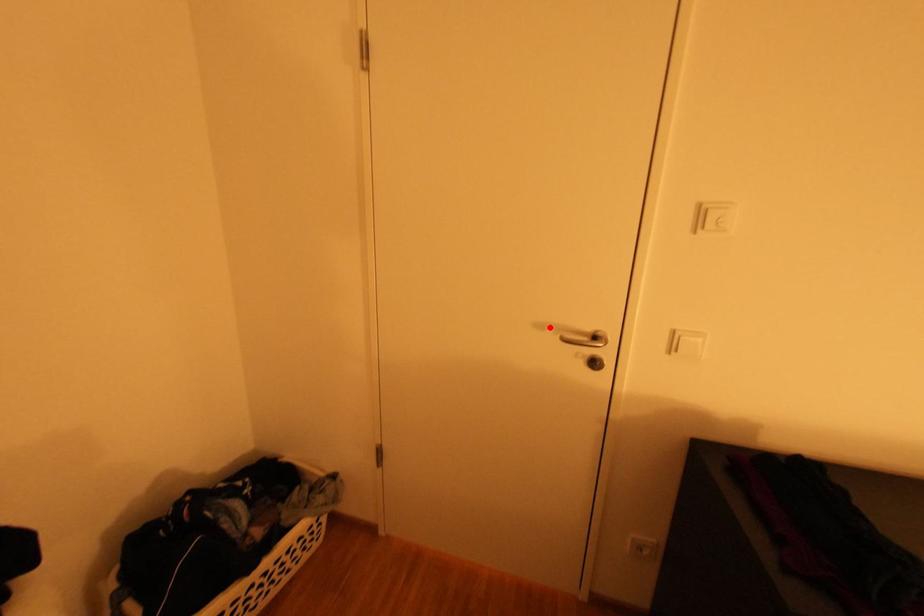
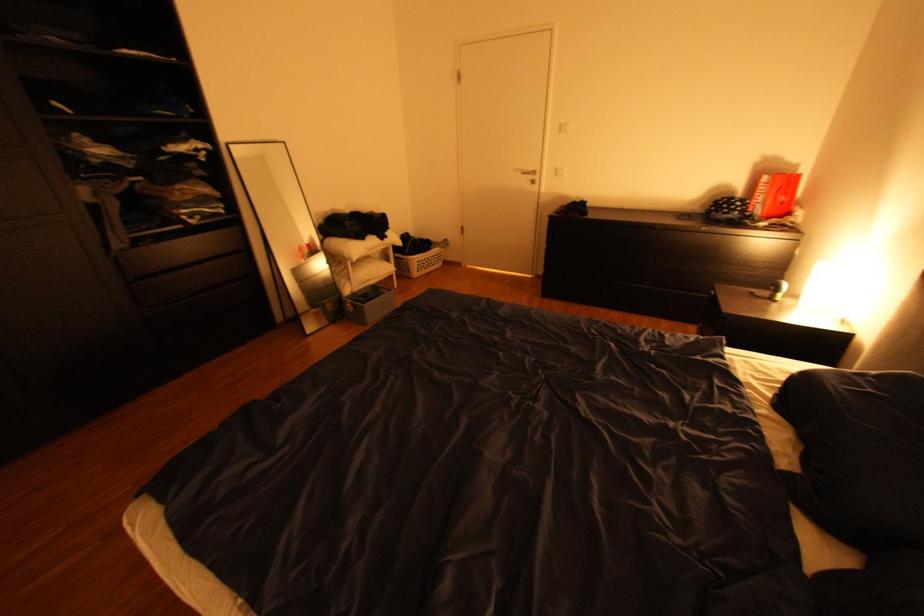
In the second image, find the point that corresponds to the highlighted location in the first image.

(526, 171)